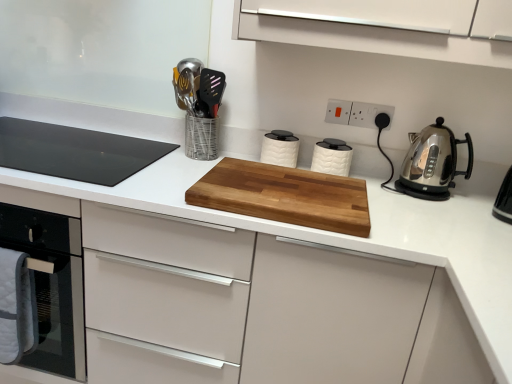
Question: Is natural wood cutting board at center oriented towards white plastic electrical outlet at upper center, positioned as the second electric outlet in left-to-right order?

Choices:
 (A) no
 (B) yes

Answer: (A)

Question: Is natural wood cutting board at center smaller than white plastic electrical outlet at upper center, positioned as the second electric outlet in left-to-right order?

Choices:
 (A) no
 (B) yes

Answer: (A)

Question: Is natural wood cutting board at center next to white plastic electrical outlet at upper center, which ranks as the 1th electric outlet in right-to-left order, and touching it?

Choices:
 (A) no
 (B) yes

Answer: (A)

Question: Is the position of natural wood cutting board at center more distant than that of white plastic electrical outlet at upper center, which ranks as the 1th electric outlet in right-to-left order?

Choices:
 (A) no
 (B) yes

Answer: (A)

Question: Is natural wood cutting board at center taller than white plastic electrical outlet at upper center, positioned as the second electric outlet in left-to-right order?

Choices:
 (A) no
 (B) yes

Answer: (A)

Question: Considering the positions of white textured canister at center, the third kitchen appliance positioned from the right, and natural wood cutting board at center in the image, is white textured canister at center, the third kitchen appliance positioned from the right, bigger or smaller than natural wood cutting board at center?

Choices:
 (A) small
 (B) big

Answer: (A)

Question: Is white textured canister at center, the first kitchen appliance in the left-to-right sequence, taller or shorter than natural wood cutting board at center?

Choices:
 (A) short
 (B) tall

Answer: (B)

Question: From the image's perspective, relative to natural wood cutting board at center, is white textured canister at center, the third kitchen appliance positioned from the right, above or below?

Choices:
 (A) above
 (B) below

Answer: (A)

Question: Based on their positions, is white textured canister at center, the third kitchen appliance positioned from the right, located to the left or right of natural wood cutting board at center?

Choices:
 (A) left
 (B) right

Answer: (B)

Question: From the image's perspective, is white plastic electrical outlet at upper center, which ranks as the 1th electric outlet in right-to-left order, positioned above or below white plastic electric outlet at upper center, the 2th electric outlet positioned from the right?

Choices:
 (A) above
 (B) below

Answer: (B)

Question: Would you say white plastic electrical outlet at upper center, which ranks as the 1th electric outlet in right-to-left order, is to the left or to the right of white plastic electric outlet at upper center, the 2th electric outlet positioned from the right, in the picture?

Choices:
 (A) left
 (B) right

Answer: (B)

Question: Choose the correct answer: Is white plastic electrical outlet at upper center, positioned as the second electric outlet in left-to-right order, inside white plastic electric outlet at upper center, arranged as the first electric outlet when viewed from the left, or outside it?

Choices:
 (A) inside
 (B) outside

Answer: (B)

Question: Is point (346, 110) positioned closer to the camera than point (349, 114)?

Choices:
 (A) closer
 (B) farther

Answer: (A)

Question: In terms of height, does black glass cooktop at left look taller or shorter compared to white plastic electric outlet at upper center, arranged as the first electric outlet when viewed from the left?

Choices:
 (A) tall
 (B) short

Answer: (B)

Question: Relative to white plastic electric outlet at upper center, the 2th electric outlet positioned from the right, is black glass cooktop at left in front or behind?

Choices:
 (A) behind
 (B) front

Answer: (B)